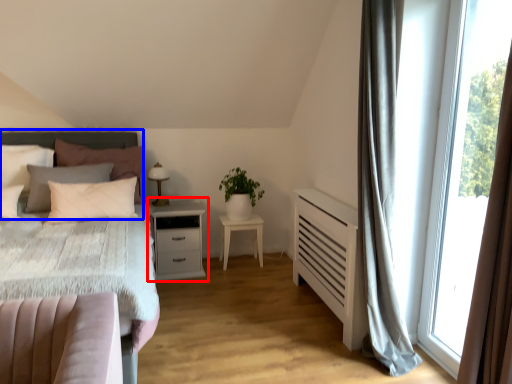
Question: Which of the following is the closest to the observer, nightstand (highlighted by a red box) or headboard (highlighted by a blue box)?

Choices:
 (A) nightstand
 (B) headboard

Answer: (B)